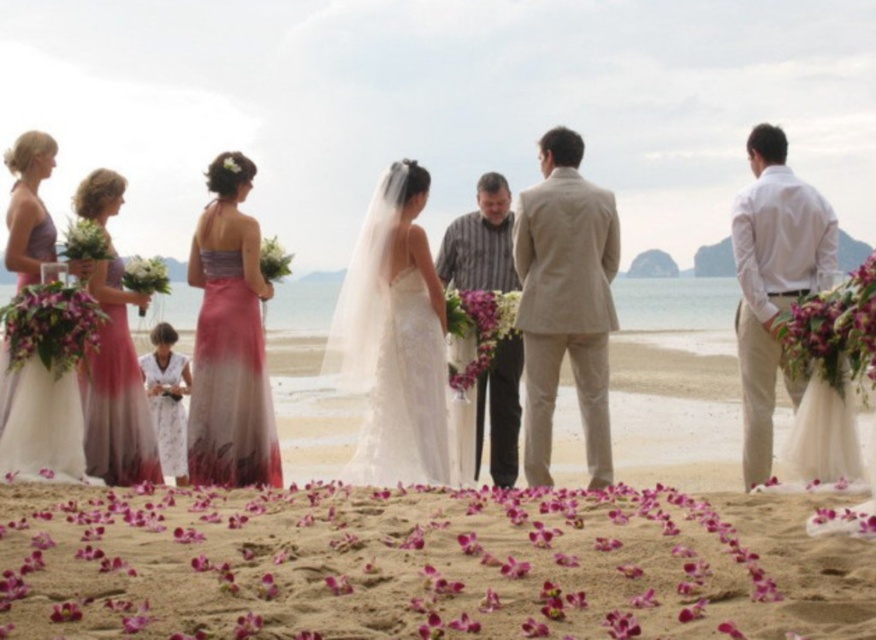
Based on the photo, in the beach wedding scene, there is a point marked at coordinates (831, 330). Which object is located at this point?

The point at coordinates (831, 330) corresponds to the purple floral bouquet at right.

You are a photographer positioned at the scene to capture the wedding couple. You need to place a purple floral bouquet at right in the frame for a closeup shot. Considering the distance of the bouquet from you, will you need to zoom in or zoom out to focus on it?

The purple floral bouquet at right is 25.79 feet away from the viewer. To focus on it for a closeup shot, you would need to zoom in to bring the bouquet into clearer focus and fill the frame.

You are standing at the beach wedding scene and want to place a bouquet between the two points, point 1 at coordinates point (x=41, y=465) and point 2 at coordinates point (x=507, y=332). Which point is closer to you so that the bouquet can be placed in the middle between them?

Point (x=41, y=465) is closer to the viewer than point (x=507, y=332). To place the bouquet in the middle between them, you should position it halfway between the two points along the line connecting them.